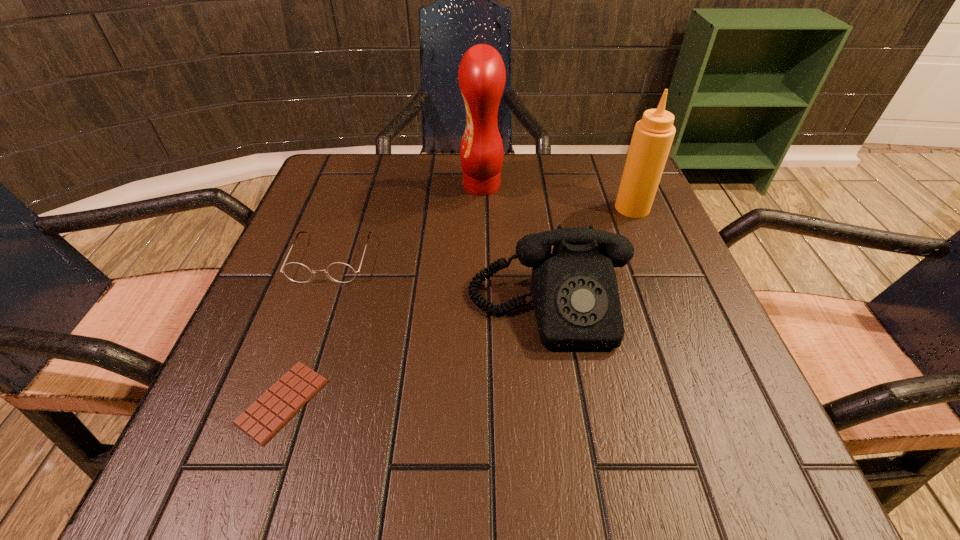
The image size is (960, 540). Identify the location of the left condiment. (482, 75).

This screenshot has width=960, height=540. In order to click on the rightmost object in this screenshot , I will do `click(653, 135)`.

Identify the location of the third shortest object. (574, 290).

Locate an element on the screen. the fourth tallest object is located at coordinates (342, 273).

The width and height of the screenshot is (960, 540). I want to click on the nearest object, so click(x=265, y=417).

Find the location of a particular element. the shortest object is located at coordinates (265, 417).

Where is `vacant space positioned 0.080m on the label side of the left condiment`? This screenshot has height=540, width=960. vacant space positioned 0.080m on the label side of the left condiment is located at coordinates (426, 186).

What are the coordinates of `vacant area situated 0.280m on the label side of the left condiment` in the screenshot? It's located at (338, 186).

Where is `free location located on the label side of the left condiment`? The height and width of the screenshot is (540, 960). free location located on the label side of the left condiment is located at coordinates (439, 186).

Find the location of a particular element. The image size is (960, 540). free space located 0.050m on the front of the right condiment is located at coordinates click(x=643, y=234).